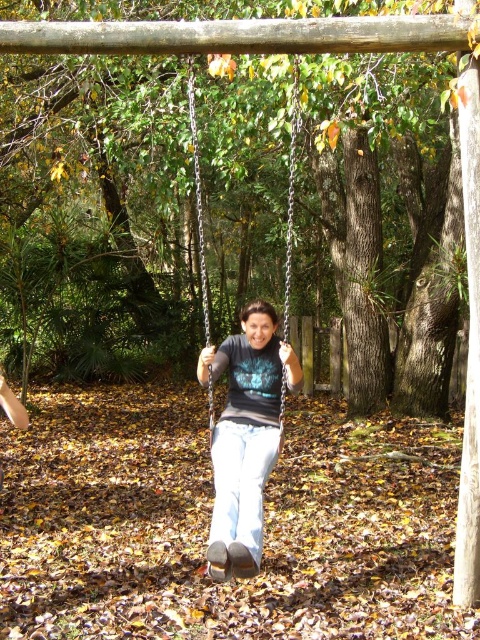
You are standing at the point marked as point (244,435) in the image. What color is the clothing item directly beneath your feet?

The point (244,435) is on the matte black shirt at center, so the clothing item directly beneath your feet is matte black.

You are a photographer wanting to capture the matte black shirt at center and the metallic chain swing at center in a single frame. Based on their sizes, which object should appear larger in the photo?

The metallic chain swing at center should appear larger in the photo because the matte black shirt at center is not as tall as the metallic chain swing at center.

You are a photographer trying to capture the person on the swing. You want to ensure the matte black shirt at center and metallic chain swing at center are both clearly visible in your shot. Based on their positions, which object should you focus on first to ensure both are in focus?

The matte black shirt at center is located below the metallic chain swing at center. Since the shirt is closer to the camera, focusing on it first will ensure both objects remain in focus as the swing is above it.